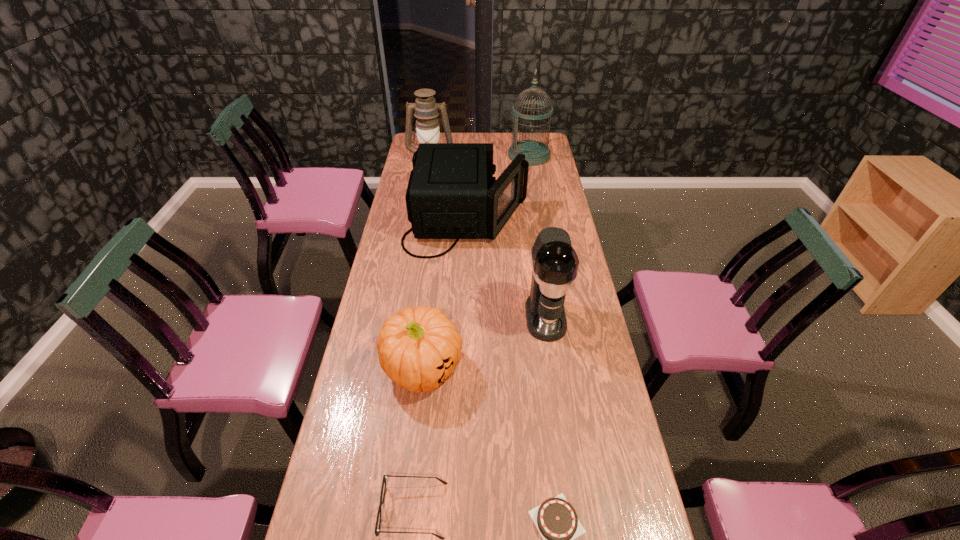
You are a GUI agent. You are given a task and a screenshot of the screen. Output one action in this format:
    pyautogui.click(x=<x>, y=<y>)
    Task: Click on the free location located with the door open on the microwave oven
    This screenshot has height=540, width=960.
    Given the screenshot: What is the action you would take?
    (569, 219)

Where is `vacant space located on the surface of the pumpkin`? The width and height of the screenshot is (960, 540). vacant space located on the surface of the pumpkin is located at coordinates (414, 448).

Where is `object at the far edge`? The width and height of the screenshot is (960, 540). object at the far edge is located at coordinates (536, 153).

I want to click on oil lamp that is at the left edge, so click(x=426, y=109).

You are a GUI agent. You are given a task and a screenshot of the screen. Output one action in this format:
    pyautogui.click(x=<x>, y=<y>)
    Task: Click on the microwave oven present at the left edge
    
    Given the screenshot: What is the action you would take?
    pyautogui.click(x=451, y=194)

This screenshot has height=540, width=960. Identify the location of pumpkin at the left edge. (418, 348).

Where is `birdcage present at the right edge`? The width and height of the screenshot is (960, 540). birdcage present at the right edge is located at coordinates (536, 153).

You are a GUI agent. You are given a task and a screenshot of the screen. Output one action in this format:
    pyautogui.click(x=<x>, y=<y>)
    Task: Click on the coffee maker that is at the right edge
    This screenshot has width=960, height=540.
    Given the screenshot: What is the action you would take?
    pyautogui.click(x=555, y=263)

Where is `object that is at the far right corner`? This screenshot has height=540, width=960. object that is at the far right corner is located at coordinates (536, 153).

The height and width of the screenshot is (540, 960). Identify the location of free space at the far edge of the desktop. (507, 136).